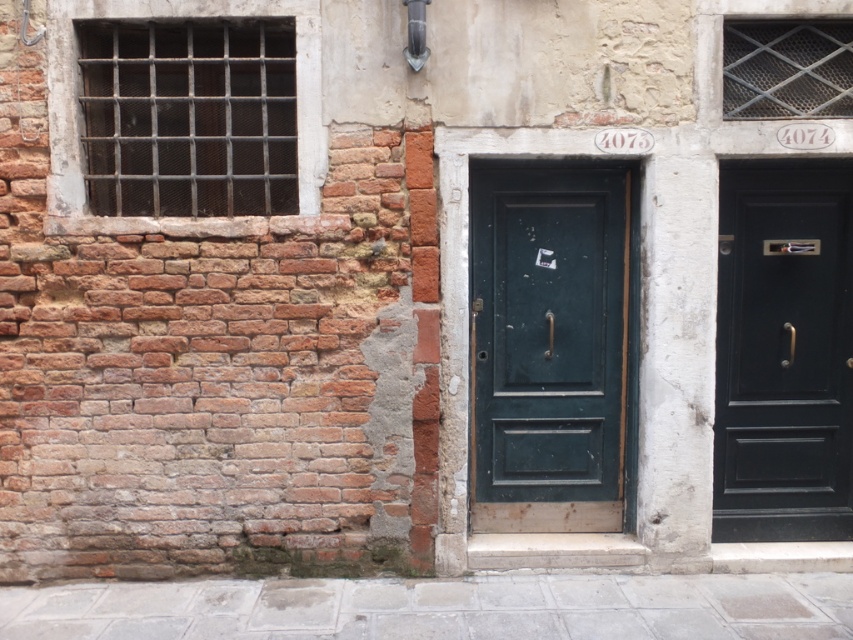
You are standing in front of the building wall with two doors and a window. You notice two points marked on the wall at coordinates point (583, 266) and point (850, 326). Which of these points is located closer to your current position?

Point (583, 266) is closer to the viewer than point (850, 326).

You are a delivery person trying to enter the building. You have a large package that requires a door with a minimum width of 80 cm. Given that the dark green wooden door at center is smaller than the matte black door at center right, which door should you use?

The matte black door at center right should be used because it is larger than the dark green wooden door at center, providing sufficient width for the large package.

In the scene shown: You are standing in front of the building shown in the image. You need to enter through the dark green wooden door at center. Based on its 2D coordinates, where should you look to find the door?

The dark green wooden door at center is located at the 2D coordinates point (548,346), so you should look towards the central area of the building wall to find the door.